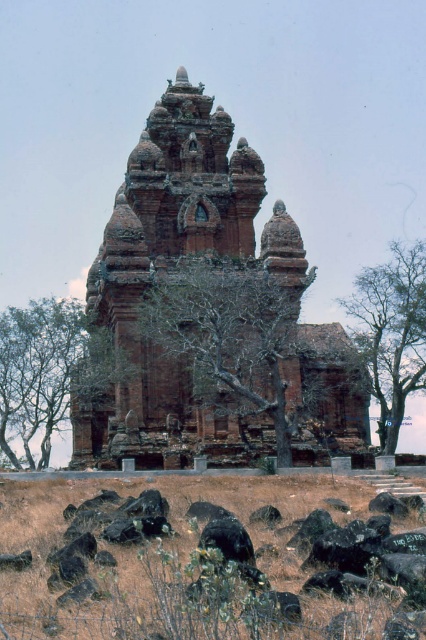
Question: Does brown rock pile at center appear on the left side of bare branches at center?

Choices:
 (A) yes
 (B) no

Answer: (B)

Question: Among these points, which one is farthest from the camera?

Choices:
 (A) (167, 83)
 (B) (40, 636)

Answer: (A)

Question: Which object is the farthest from the bare branches at center?

Choices:
 (A) bare wood tree at center
 (B) brown rock pile at center
 (C) brown stone temple at center
 (D) green leafy tree at center

Answer: (D)

Question: Which object is closer to the camera taking this photo?

Choices:
 (A) green leafy tree at center
 (B) bare branches at center

Answer: (B)

Question: Does bare wood tree at center have a larger size compared to bare branches at center?

Choices:
 (A) no
 (B) yes

Answer: (A)

Question: Is brown rock pile at center further to the viewer compared to green leafy tree at center?

Choices:
 (A) no
 (B) yes

Answer: (A)